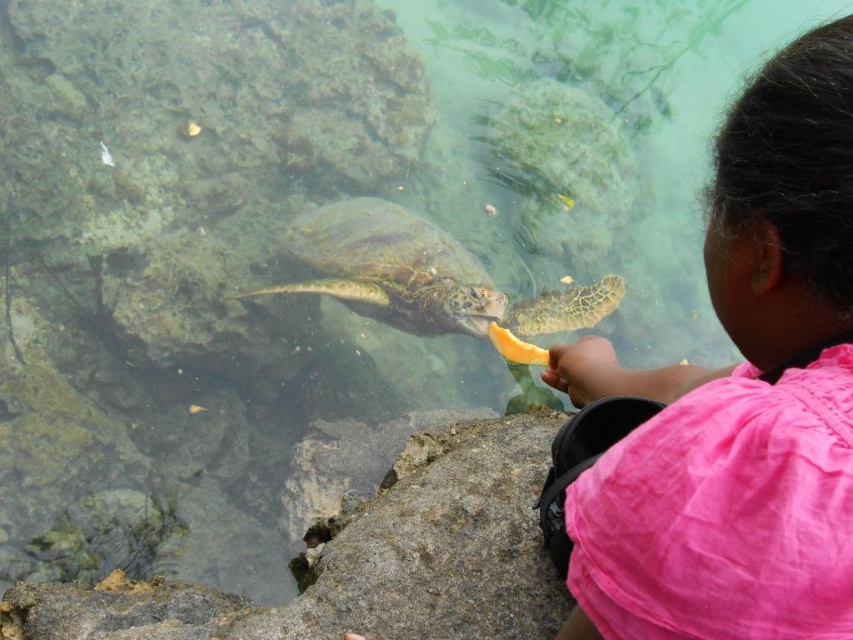
Question: Can you confirm if pink fabric shirt at upper right is positioned below green textured shell at center?

Choices:
 (A) yes
 (B) no

Answer: (A)

Question: Can you confirm if pink fabric shirt at upper right is bigger than green textured shell at center?

Choices:
 (A) yes
 (B) no

Answer: (B)

Question: Is pink fabric shirt at upper right in front of green textured shell at center?

Choices:
 (A) yes
 (B) no

Answer: (A)

Question: Which object is closer to the camera taking this photo?

Choices:
 (A) pink fabric shirt at upper right
 (B) green textured shell at center

Answer: (A)